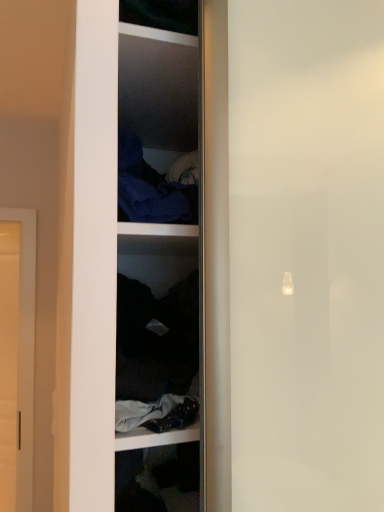
Question: Is matte white door at left inside or outside of dark fabric at center?

Choices:
 (A) inside
 (B) outside

Answer: (B)

Question: From a real-world perspective, relative to dark fabric at center, is matte white door at left vertically above or below?

Choices:
 (A) above
 (B) below

Answer: (B)

Question: Which is nearer to the dark blue fabric at upper center?

Choices:
 (A) matte white door at left
 (B) dark fabric at center

Answer: (B)

Question: Considering the real-world distances, which object is closest to the matte white door at left?

Choices:
 (A) dark blue fabric at upper center
 (B) dark fabric at center

Answer: (B)